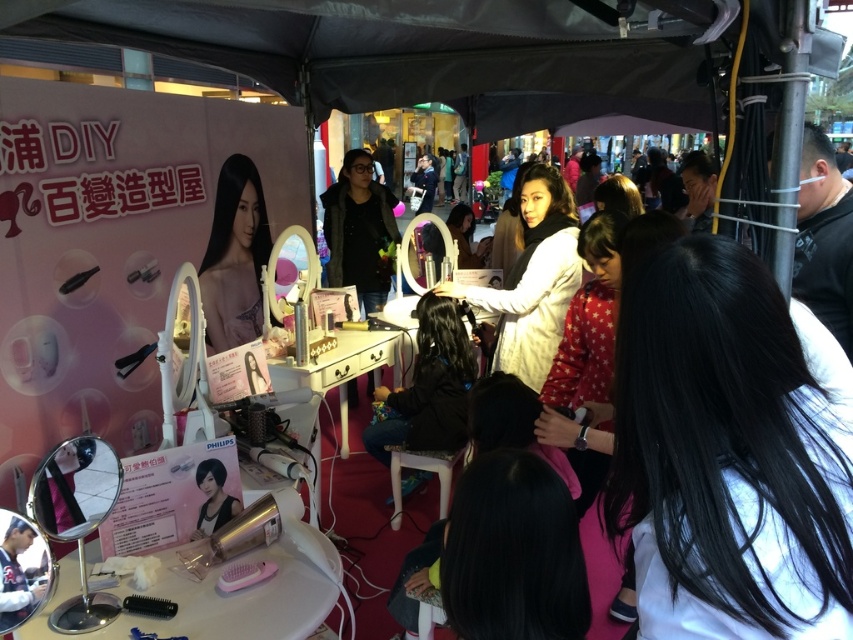
How distant is white matte hairdresser at center from smooth black hair at center?

A distance of 4.03 feet exists between white matte hairdresser at center and smooth black hair at center.

Can you confirm if white matte hairdresser at center is positioned below smooth black hair at center?

Correct, white matte hairdresser at center is located below smooth black hair at center.

What are the coordinates of `white matte hairdresser at center` in the screenshot? It's located at (532, 280).

Is the position of white matte hairdresser at center more distant than that of dark brown hair at center?

No, it is in front of dark brown hair at center.

Who is lower down, white matte hairdresser at center or dark brown hair at center?

dark brown hair at center

This screenshot has height=640, width=853. Describe the element at coordinates (532, 280) in the screenshot. I see `white matte hairdresser at center` at that location.

This screenshot has height=640, width=853. What are the coordinates of `white matte hairdresser at center` in the screenshot? It's located at (532, 280).

Is dark brown hair at center thinner than smooth black hair at center?

No, dark brown hair at center is not thinner than smooth black hair at center.

Is dark brown hair at center above smooth black hair at center?

No, dark brown hair at center is not above smooth black hair at center.

Who is more distant from viewer, (448, 298) or (239, 198)?

The point (239, 198) is behind.

The width and height of the screenshot is (853, 640). I want to click on dark brown hair at center, so click(428, 387).